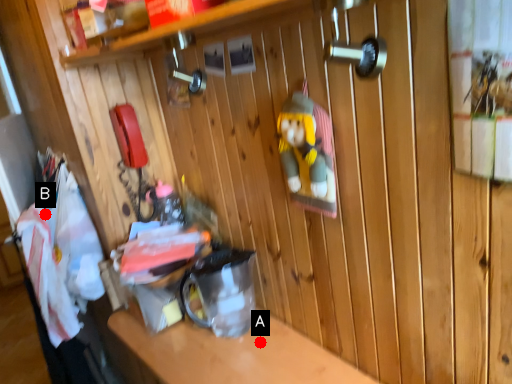
Question: Two points are circled on the image, labeled by A and B beside each circle. Which point is closer to the camera taking this photo?

Choices:
 (A) A is closer
 (B) B is closer

Answer: (A)